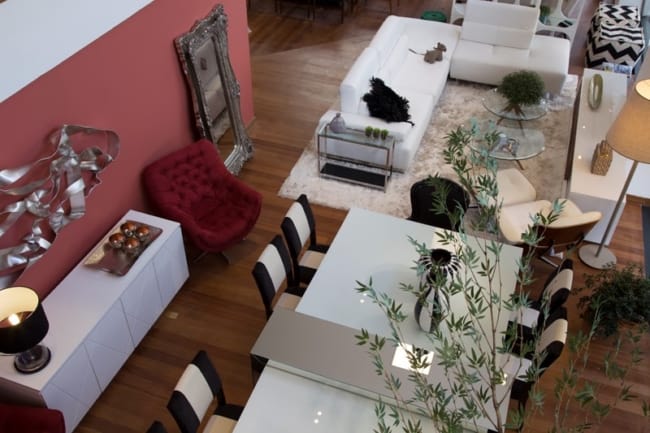
The width and height of the screenshot is (650, 433). Find the location of `white end table`. white end table is located at coordinates (86, 329).